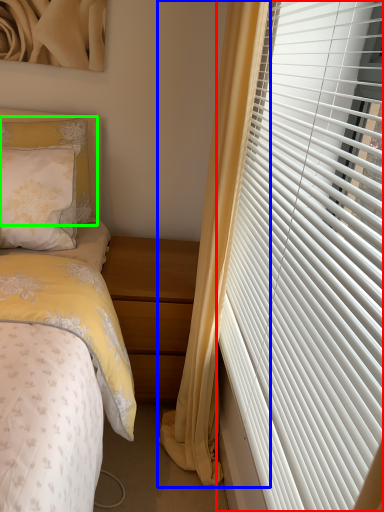
Question: Based on their relative distances, which object is nearer to window blind (highlighted by a red box)? Choose from curtain (highlighted by a blue box) and pillow (highlighted by a green box).

Choices:
 (A) curtain
 (B) pillow

Answer: (A)